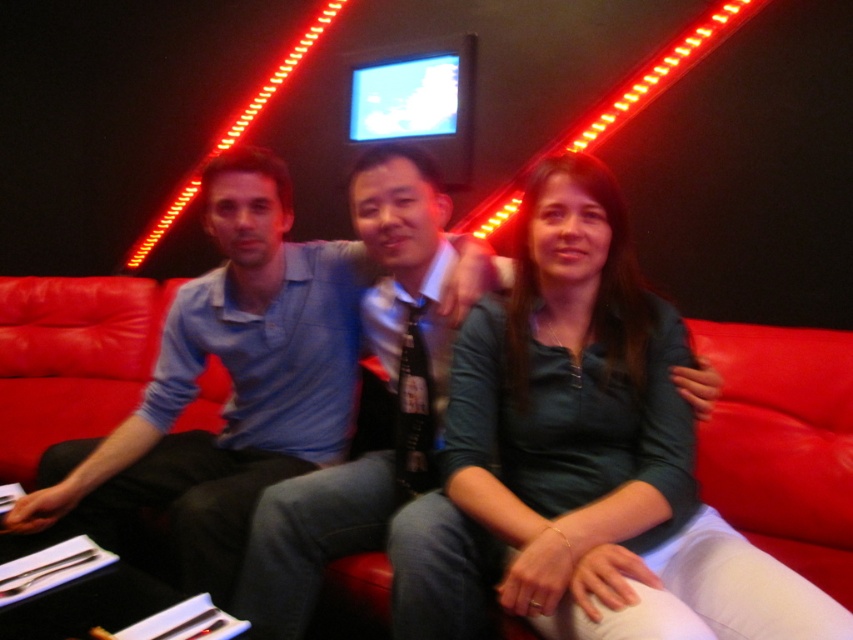
Question: Among these objects, which one is farthest from the camera?

Choices:
 (A) red leather couch at center
 (B) matte green shirt at center
 (C) blue shirt at center

Answer: (A)

Question: Which point is farther to the camera?

Choices:
 (A) (90, 358)
 (B) (491, 506)

Answer: (A)

Question: Does blue shirt at center have a smaller size compared to red leather couch at center?

Choices:
 (A) yes
 (B) no

Answer: (A)

Question: Can you confirm if matte green shirt at center is thinner than blue shirt at center?

Choices:
 (A) no
 (B) yes

Answer: (B)

Question: Which point is closer to the camera taking this photo?

Choices:
 (A) (643, 502)
 (B) (752, 484)

Answer: (A)

Question: Observing the image, what is the correct spatial positioning of blue shirt at center in reference to red leather couch at center?

Choices:
 (A) left
 (B) right

Answer: (B)